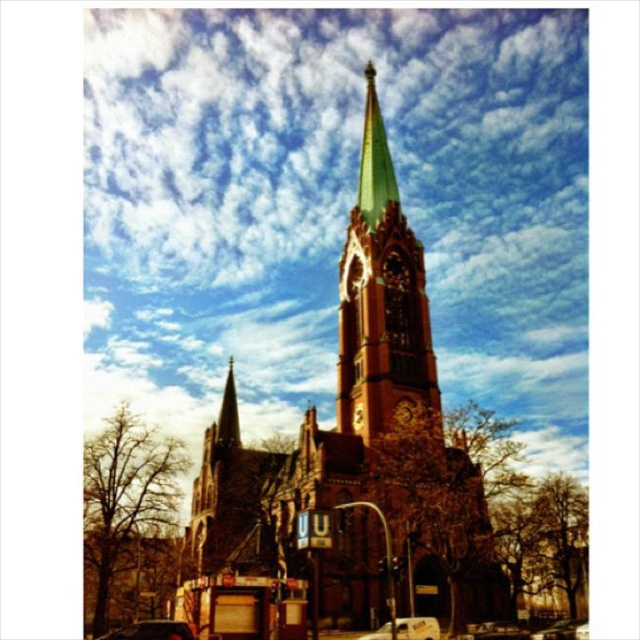
You are a pedestrian standing at the entrance of the Gothic church. You notice two metallic silver cars in the parking lot. Which car, the metallic silver car at lower left or the metallic silver car at center, is closer to you?

The metallic silver car at lower left is closer to you because it is in front of the metallic silver car at center.

In the scene shown: You are a photographer planning to take a photo of the Gothic church. You notice two metallic silver cars in the foreground. Which car, the metallic silver car at lower left or the metallic silver car at center, would appear closer to the camera if both are in the same frame?

The metallic silver car at lower left appears closer to the camera because it is larger in size than the metallic silver car at center.

You are a photographer planning to capture the Gothic church and its surroundings. You notice a metallic silver car at center and a golden metallic clock at center in the frame. Which object should you adjust your camera angle to focus on if you want to highlight the taller object?

The metallic silver car at center is taller than the golden metallic clock at center, so you should focus on the metallic silver car at center to highlight the taller object.